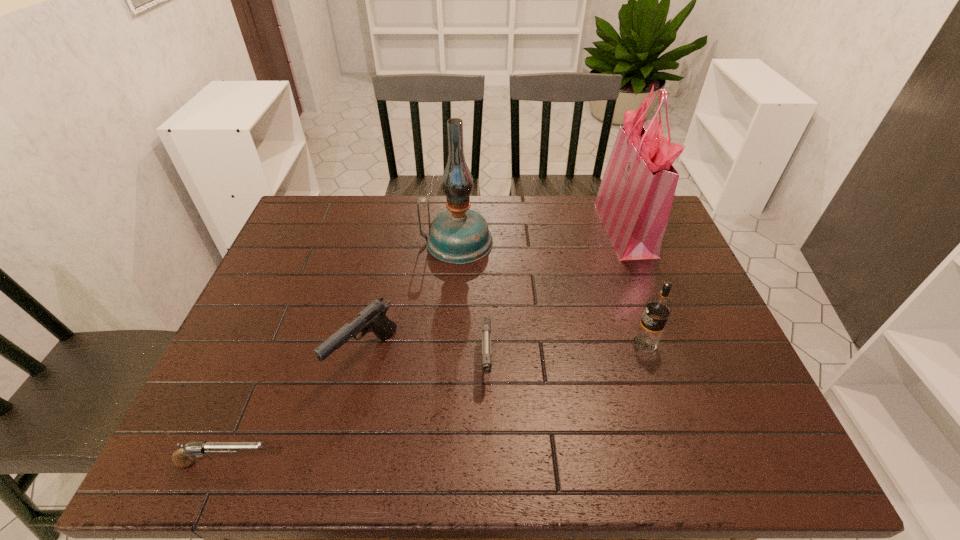
This screenshot has width=960, height=540. Identify the location of vacant area that lies between the oil lamp and the rightmost gun. (471, 301).

This screenshot has height=540, width=960. Find the location of `free space between the second object from left to right and the shortest object`. free space between the second object from left to right and the shortest object is located at coordinates (295, 409).

The width and height of the screenshot is (960, 540). In order to click on vacant space that is in between the oil lamp and the shopping bag in this screenshot , I will do `click(541, 234)`.

I want to click on free spot between the rightmost gun and the fourth shortest object, so click(x=565, y=352).

Image resolution: width=960 pixels, height=540 pixels. What are the coordinates of `free space between the third tallest object and the second shortest object` in the screenshot? It's located at (565, 352).

Locate an element on the screen. vacant space that is in between the third tallest object and the shopping bag is located at coordinates (635, 285).

Locate an element on the screen. This screenshot has height=540, width=960. vacant area that lies between the second shortest object and the fifth object from right to left is located at coordinates (425, 358).

Identify the location of free space that is in between the second shortest object and the shopping bag. The width and height of the screenshot is (960, 540). (556, 294).

Where is `vacant region between the vodka and the second shortest gun`? Image resolution: width=960 pixels, height=540 pixels. vacant region between the vodka and the second shortest gun is located at coordinates (565, 352).

Locate which object ranks second in proximity to the vodka. Please provide its 2D coordinates. Your answer should be formatted as a tuple, i.e. [(x, y)], where the tuple contains the x and y coordinates of a point satisfying the conditions above.

[(486, 321)]